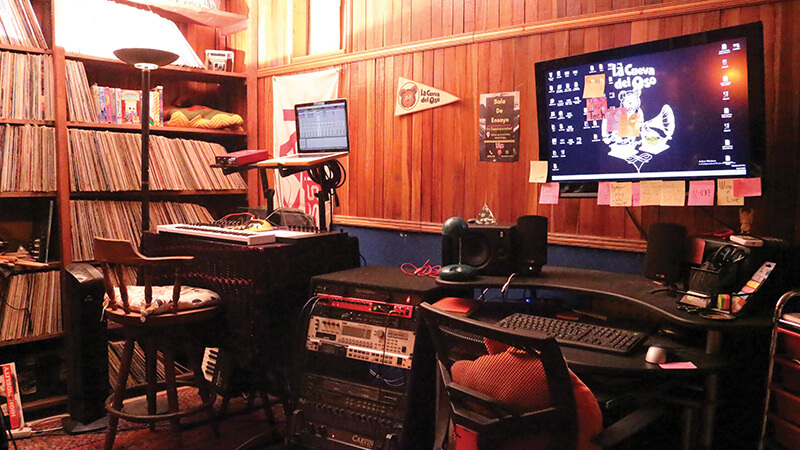
Locate an element on the screen. The image size is (800, 450). the back of stool is located at coordinates (110, 251).